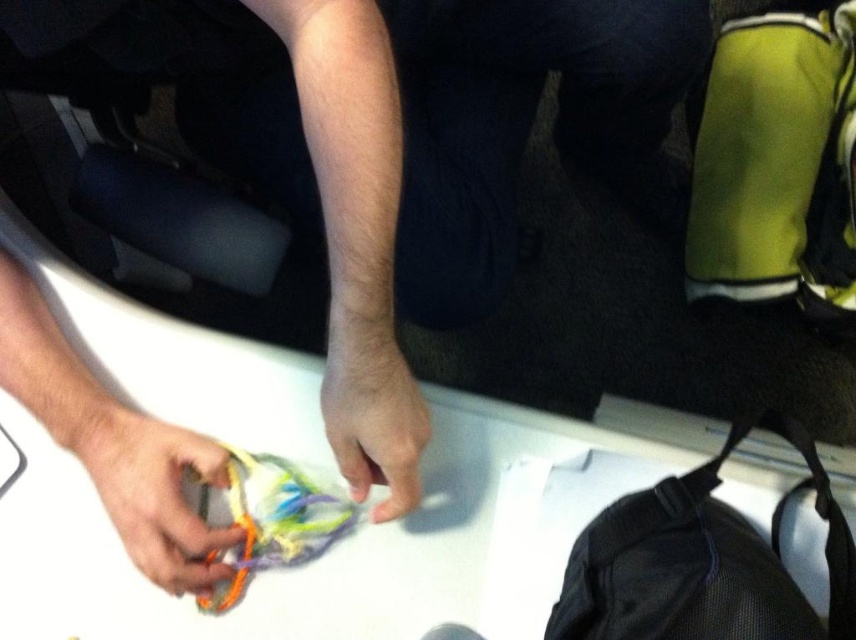
Question: Which of the following is the closest to the observer?

Choices:
 (A) white matte table at center
 (B) black mesh bag at lower right

Answer: (B)

Question: Which point appears farthest from the camera in this image?

Choices:
 (A) (839, 564)
 (B) (491, 557)

Answer: (B)

Question: Can you confirm if white matte table at center is thinner than black mesh bag at lower right?

Choices:
 (A) yes
 (B) no

Answer: (B)

Question: Among these objects, which one is farthest from the camera?

Choices:
 (A) black mesh bag at lower right
 (B) white matte table at center

Answer: (B)

Question: Is white matte table at center closer to the viewer compared to black mesh bag at lower right?

Choices:
 (A) no
 (B) yes

Answer: (A)

Question: Does white matte table at center have a smaller size compared to black mesh bag at lower right?

Choices:
 (A) no
 (B) yes

Answer: (A)